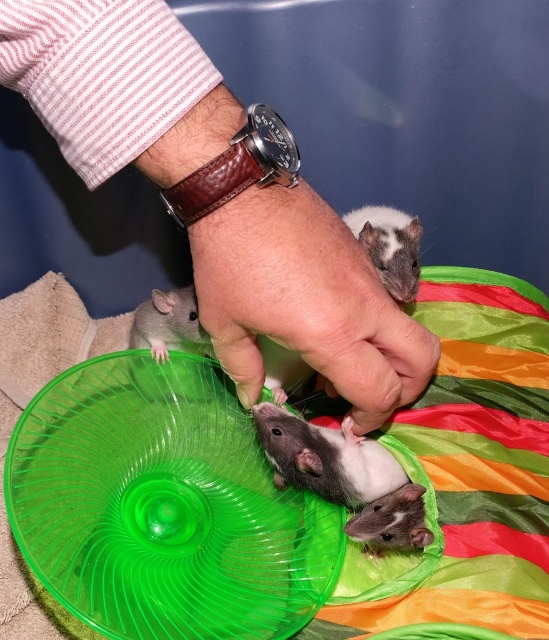
Question: Which of the following is the farthest from the observer?

Choices:
 (A) (293, 432)
 (B) (299, 248)
 (C) (411, 496)
 (D) (322, 216)

Answer: (A)

Question: Which of the following is the closest to the observer?

Choices:
 (A) (390, 220)
 (B) (400, 525)
 (C) (271, 448)

Answer: (B)

Question: Is leather wristwatch at center positioned in front of white matte mouse at center?

Choices:
 (A) yes
 (B) no

Answer: (A)

Question: Is leather wristwatch at center smaller than white glossy mouse at center?

Choices:
 (A) yes
 (B) no

Answer: (B)

Question: Which is nearer to the brown leather wristwatch at center?

Choices:
 (A) white glossy mouse at center
 (B) light brown fur mouse at center
 (C) white matte mouse at center

Answer: (B)

Question: Can you confirm if brown leather wristwatch at center is wider than white glossy mouse at center?

Choices:
 (A) no
 (B) yes

Answer: (B)